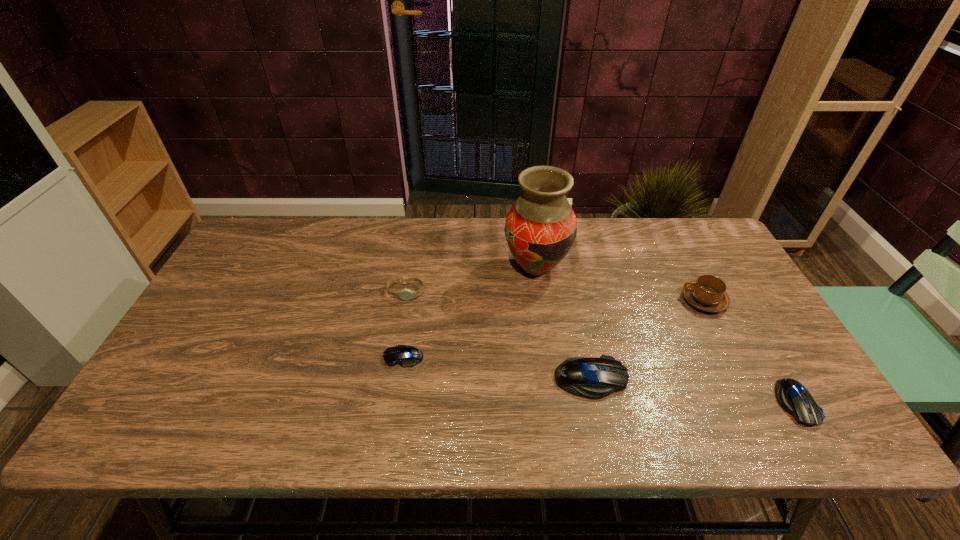
Find the location of a particular element. The image size is (960, 540). the leftmost computer mouse is located at coordinates (406, 356).

Where is `the shortest computer mouse`? the shortest computer mouse is located at coordinates (406, 356).

Where is `the tallest computer mouse`? The image size is (960, 540). the tallest computer mouse is located at coordinates (594, 378).

Locate an element on the screen. This screenshot has width=960, height=540. the fifth tallest object is located at coordinates (792, 396).

The height and width of the screenshot is (540, 960). In order to click on the second tallest computer mouse in this screenshot , I will do `click(792, 396)`.

You are a GUI agent. You are given a task and a screenshot of the screen. Output one action in this format:
    pyautogui.click(x=<x>, y=<y>)
    Task: Click on the watch
    Image resolution: width=960 pixels, height=540 pixels.
    Given the screenshot: What is the action you would take?
    pyautogui.click(x=405, y=294)

Where is `vase`? The height and width of the screenshot is (540, 960). vase is located at coordinates (540, 228).

Find the location of a particular element. This screenshot has width=960, height=540. cappuccino is located at coordinates (707, 293).

I want to click on blank space located 0.100m on the button side of the shortest computer mouse, so click(x=344, y=357).

You are a GUI agent. You are given a task and a screenshot of the screen. Output one action in this format:
    pyautogui.click(x=<x>, y=<y>)
    Task: Click on the vacant space located 0.120m on the button side of the shortest computer mouse
    The image size is (960, 540).
    Given the screenshot: What is the action you would take?
    pyautogui.click(x=336, y=357)